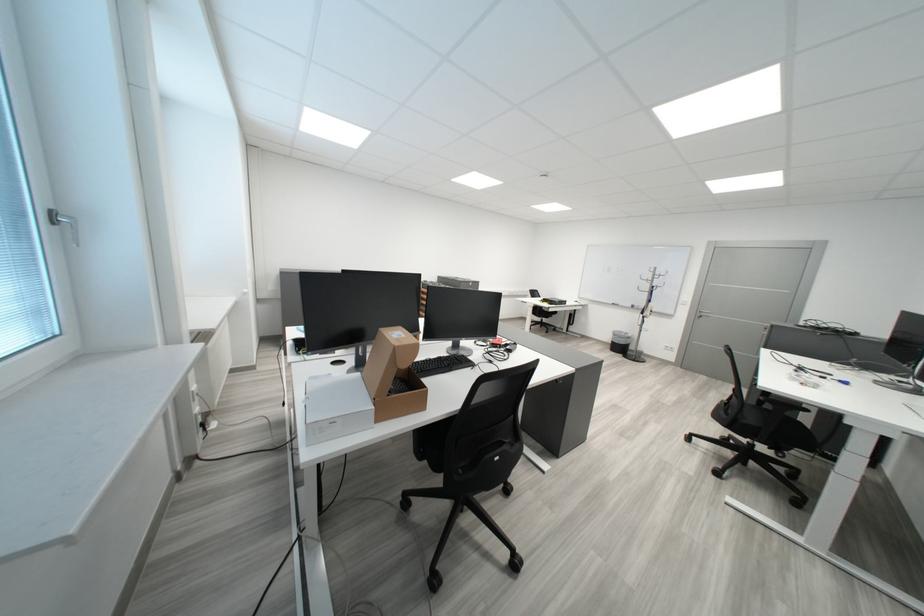
Find where to lift the white cardboard box. Please return your answer as a coordinate pair (x, y).

(335, 407)